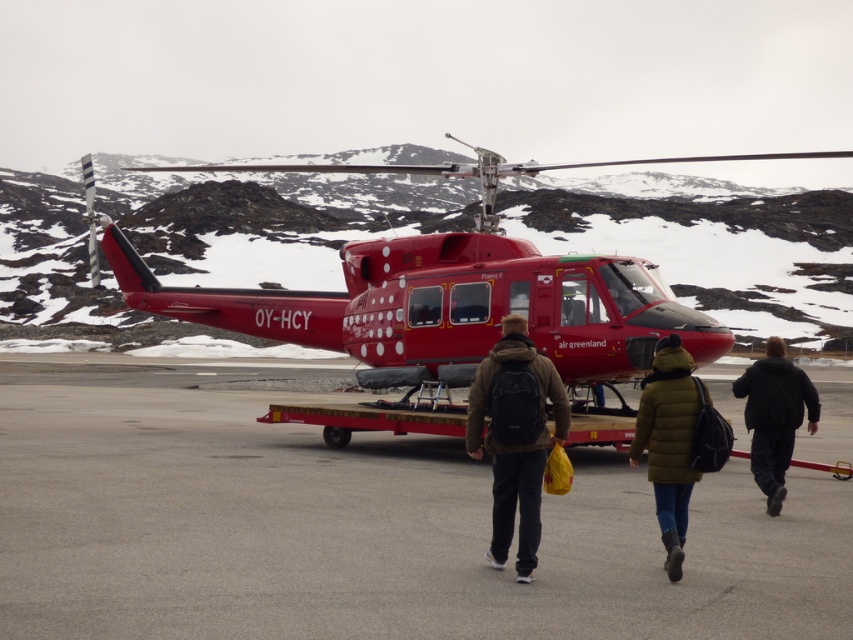
Question: Does smooth asphalt tarmac at center have a larger size compared to green down jacket at center?

Choices:
 (A) no
 (B) yes

Answer: (B)

Question: Among these objects, which one is nearest to the camera?

Choices:
 (A) brown fabric backpack at center
 (B) green down jacket at center
 (C) smooth asphalt tarmac at center
 (D) black fuzzy jacket at lower right

Answer: (C)

Question: Is green down jacket at center further to the viewer compared to black fuzzy jacket at lower right?

Choices:
 (A) yes
 (B) no

Answer: (B)

Question: Which point is closer to the camera taking this photo?

Choices:
 (A) (676, 408)
 (B) (96, 513)

Answer: (A)

Question: Does brown fabric backpack at center have a greater width compared to green down jacket at center?

Choices:
 (A) yes
 (B) no

Answer: (A)

Question: Which object is the farthest from the brown fabric backpack at center?

Choices:
 (A) black fuzzy jacket at lower right
 (B) polished red helicopter at center
 (C) green down jacket at center
 (D) smooth asphalt tarmac at center

Answer: (B)